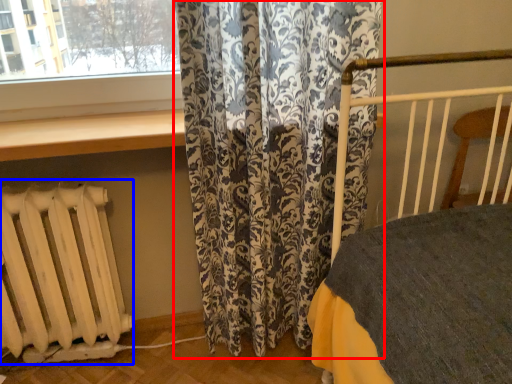
Question: Which object appears farthest to the camera in this image, curtain (highlighted by a red box) or radiator (highlighted by a blue box)?

Choices:
 (A) curtain
 (B) radiator

Answer: (B)